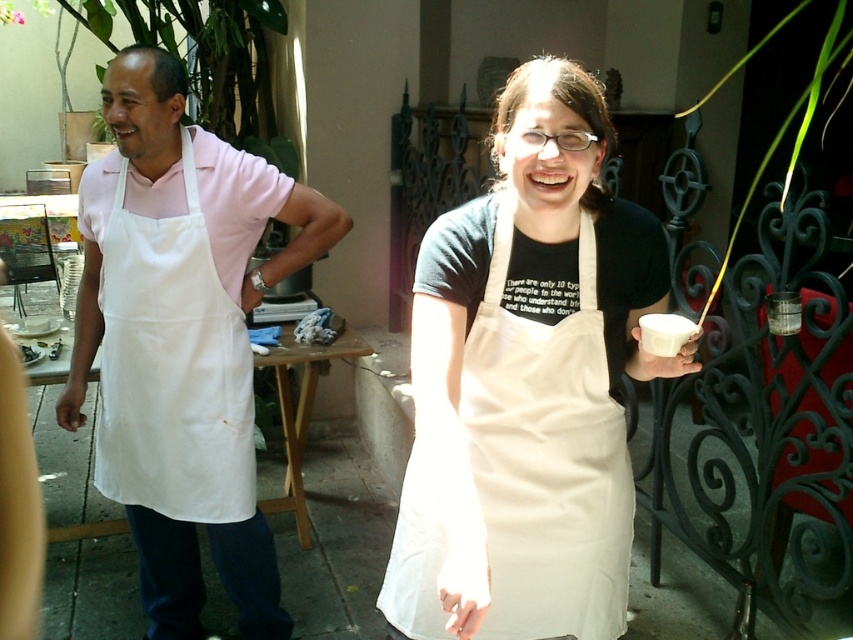
Between white cotton apron at center and white apron at left, which one is positioned lower?

white apron at left is below.

Can you confirm if white cotton apron at center is shorter than white apron at left?

Correct, white cotton apron at center is not as tall as white apron at left.

I want to click on white cotton apron at center, so click(527, 385).

Locate an element on the screen. The image size is (853, 640). white cotton apron at center is located at coordinates (527, 385).

Does white cotton apron at left have a larger size compared to white paper cup at center?

Yes.

Which is above, white cotton apron at left or white paper cup at center?

white paper cup at center is above.

Is point (248, 470) positioned behind point (659, 339)?

Yes, it is.

Identify the location of white cotton apron at left. (172, 368).

Between white cotton apron at center and white cotton apron at left, which one is positioned higher?

white cotton apron at left is above.

Is white cotton apron at center below white cotton apron at left?

Indeed, white cotton apron at center is positioned under white cotton apron at left.

Find the location of `white cotton apron at center`. white cotton apron at center is located at coordinates (527, 385).